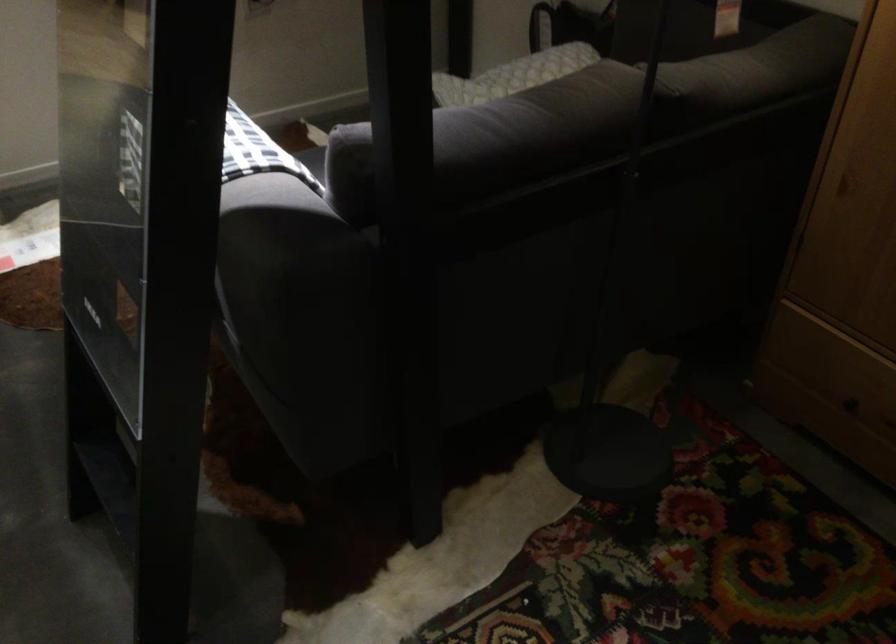
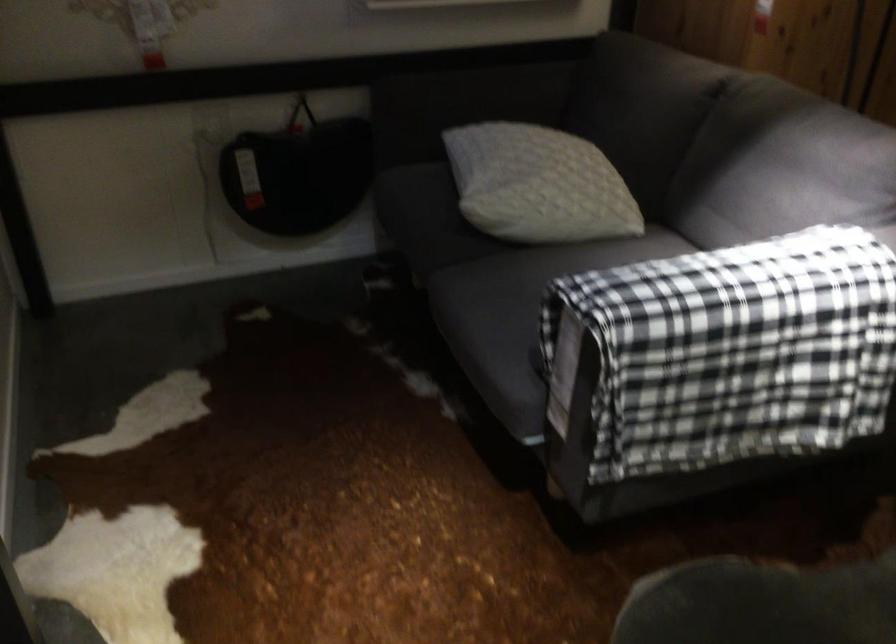
Locate, in the second image, the point that corresponds to point 476,91 in the first image.

(538, 185)